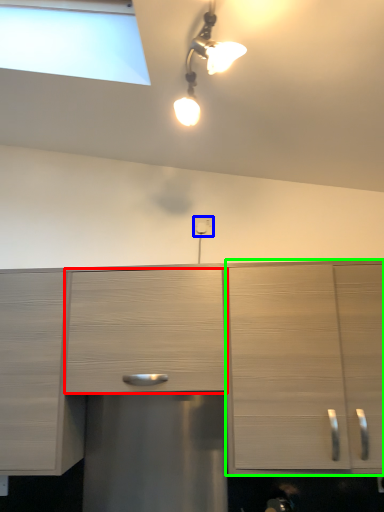
Question: Which object is the farthest from drawer (highlighted by a red box)? Choose among these: electric outlet (highlighted by a blue box) or cabinetry (highlighted by a green box).

Choices:
 (A) electric outlet
 (B) cabinetry

Answer: (A)